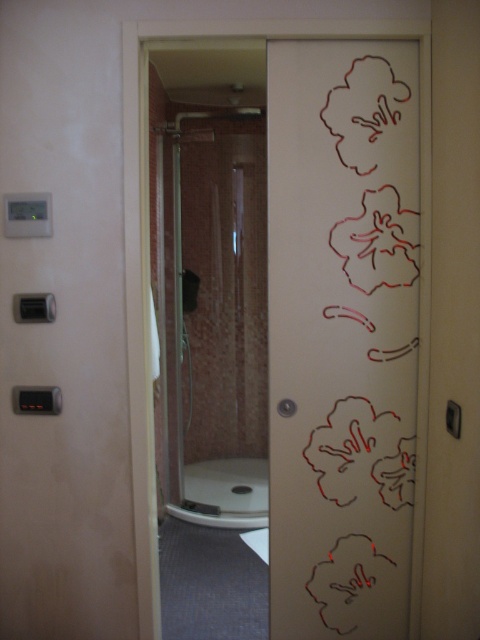
You are a delivery person trying to carry a large box through the transparent glass door at right and the clear glass shower at center. Which one has a smaller width and is easier to pass through?

The transparent glass door at right is thinner than the clear glass shower at center, so it has a smaller width and is easier to pass through.

You are a delivery person trying to enter the bathroom through the partially open door. You have a long package that is 1.8 meters in height. Will the transparent glass door at right and the clear glass shower at center allow you to bring the package inside without tilting it?

The transparent glass door at right is not as tall as clear glass shower at center. Since the shower is taller, the package might fit if placed vertically inside the shower area, but the door is shorter. However, the package is 1.8 meters tall, so it likely cannot be brought in upright through the door without tilting.

You are standing in front of the bathroom door and want to determine which of the two points, point (307, 412) or point (244, 266), is closer to you. Based on the scene description, which point is nearer?

Point (307, 412) is closer to the camera than point (244, 266).